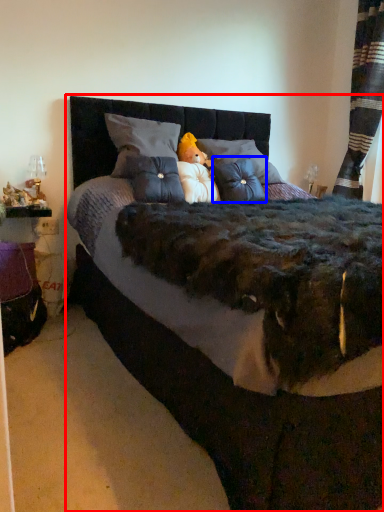
Question: Which point is closer to the camera, bed (highlighted by a red box) or throw pillow (highlighted by a blue box)?

Choices:
 (A) bed
 (B) throw pillow

Answer: (A)